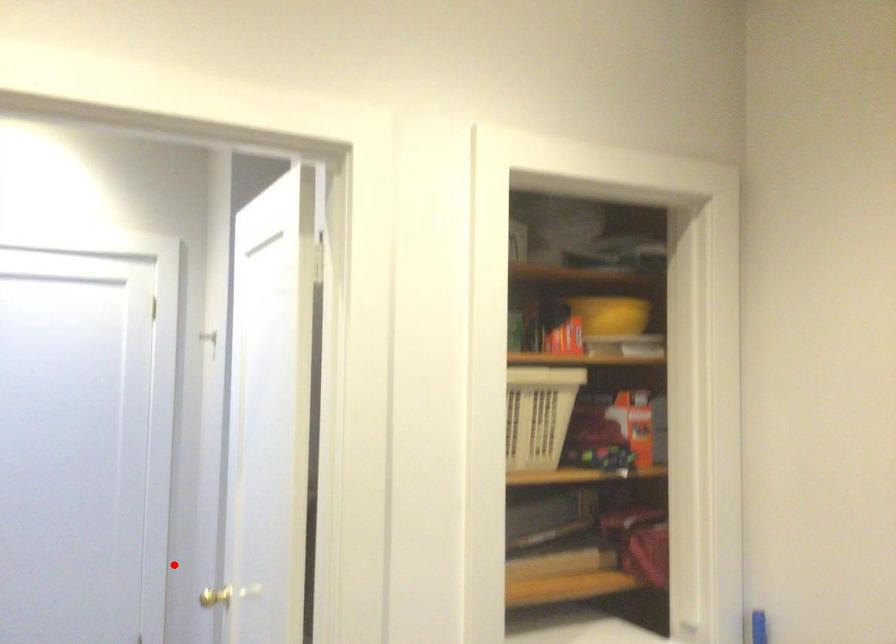
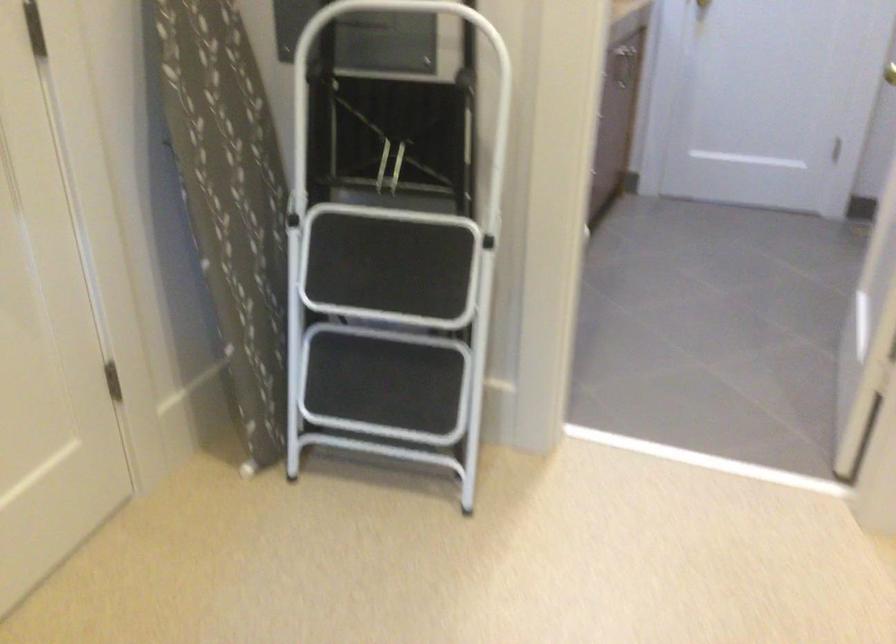
The point at the highlighted location is marked in the first image. Where is the corresponding point in the second image?

(890, 73)